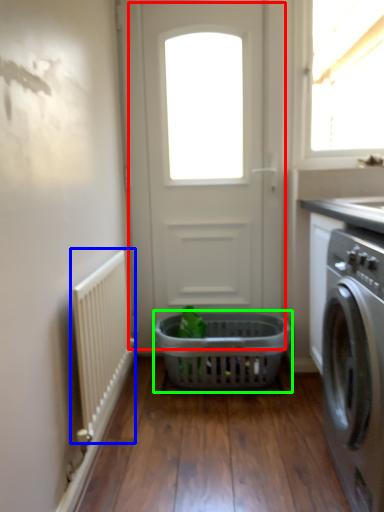
Question: Which object is positioned farthest from door (highlighted by a red box)? Select from radiator (highlighted by a blue box) and basket (highlighted by a green box).

Choices:
 (A) radiator
 (B) basket

Answer: (A)